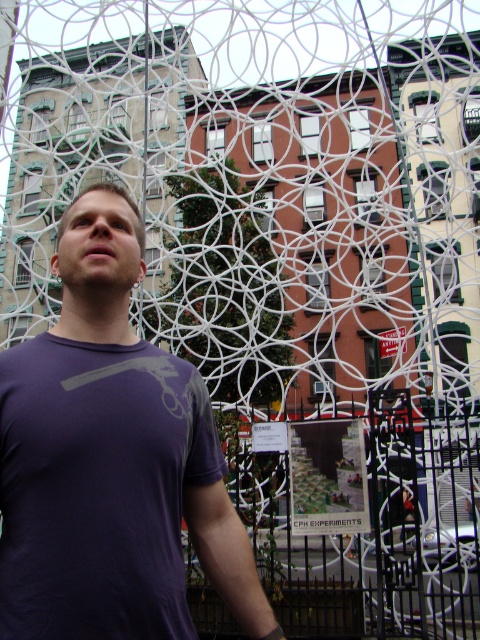
Is purple cotton t-shirt at center thinner than black wrought iron fence at center?

Correct, purple cotton t-shirt at center's width is less than black wrought iron fence at center's.

Does purple cotton t-shirt at center appear under black wrought iron fence at center?

No.

What do you see at coordinates (110, 460) in the screenshot?
I see `purple cotton t-shirt at center` at bounding box center [110, 460].

Identify the location of purple cotton t-shirt at center. Image resolution: width=480 pixels, height=640 pixels. (110, 460).